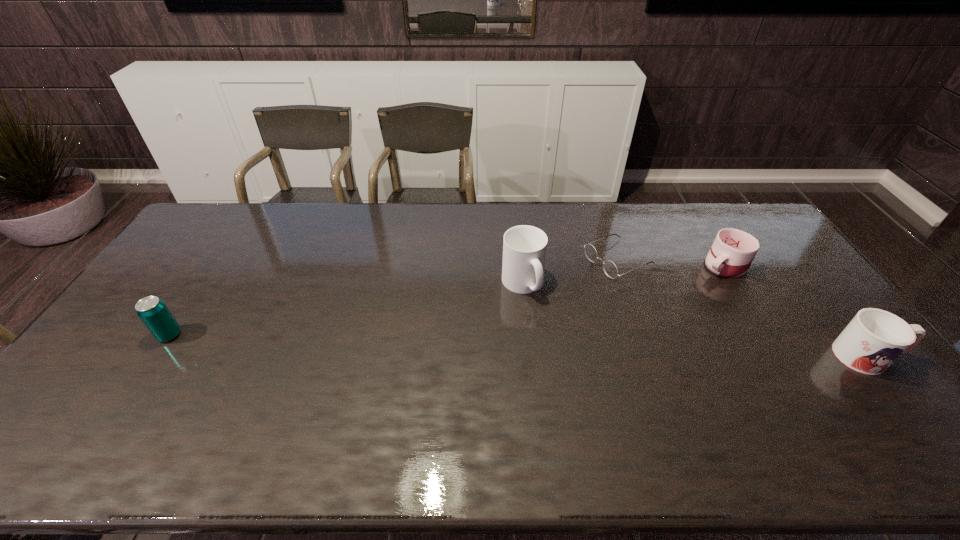
This screenshot has width=960, height=540. I want to click on free space between the shortest object and the leftmost object, so click(394, 298).

Locate an element on the screen. free area in between the nearest mug and the beer can is located at coordinates (518, 346).

Find the location of a particular element. The height and width of the screenshot is (540, 960). vacant area that lies between the rightmost mug and the shortest object is located at coordinates (743, 308).

This screenshot has width=960, height=540. What are the coordinates of `object that is the third closest to the second shortest object` in the screenshot? It's located at (524, 247).

I want to click on object that stands as the closest to the second mug from right to left, so click(x=610, y=268).

At what (x,y) coordinates should I click in order to perform the action: click on mug that is the second closest to the rightmost mug. Please return your answer as a coordinate pair (x, y). The image size is (960, 540). Looking at the image, I should click on (524, 247).

Identify the location of mug identified as the second closest to the tallest object. (874, 339).

Where is `vacant region that satisfies the following two spatial constraints: 1. on the back side of the leftmost object; 2. on the left side of the spectacles`? The width and height of the screenshot is (960, 540). vacant region that satisfies the following two spatial constraints: 1. on the back side of the leftmost object; 2. on the left side of the spectacles is located at coordinates (219, 260).

Identify the location of blank area in the image that satisfies the following two spatial constraints: 1. on the front side of the nearest mug; 2. on the side of the tallest mug with the handle. The image size is (960, 540). (530, 356).

Locate an element on the screen. free spot that satisfies the following two spatial constraints: 1. on the back side of the leftmost mug; 2. on the left side of the second mug from left to right is located at coordinates (520, 265).